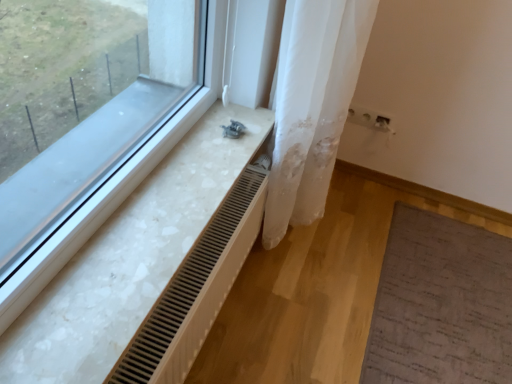
Question: Is wooden radiator at lower left wider or thinner than white sheer fabric at center?

Choices:
 (A) thin
 (B) wide

Answer: (A)

Question: From a real-world perspective, is wooden radiator at lower left physically located above or below white sheer fabric at center?

Choices:
 (A) above
 (B) below

Answer: (B)

Question: Which is farther from the white sheer fabric at center?

Choices:
 (A) wooden radiator at lower left
 (B) white marble radiator at lower left

Answer: (B)

Question: Estimate the real-world distances between objects in this image. Which object is farther from the white marble radiator at lower left?

Choices:
 (A) white sheer fabric at center
 (B) wooden radiator at lower left

Answer: (A)